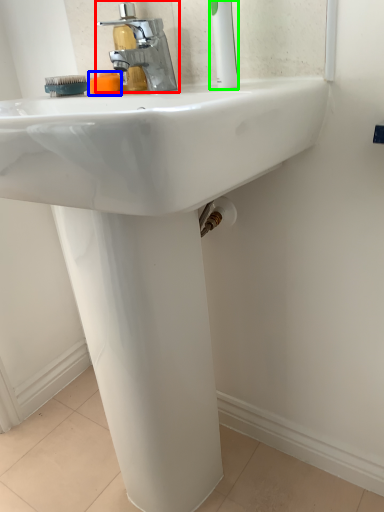
Question: Which object is positioned farthest from tap (highlighted by a red box)? Select from soap (highlighted by a blue box) and toothbrush (highlighted by a green box).

Choices:
 (A) soap
 (B) toothbrush

Answer: (B)